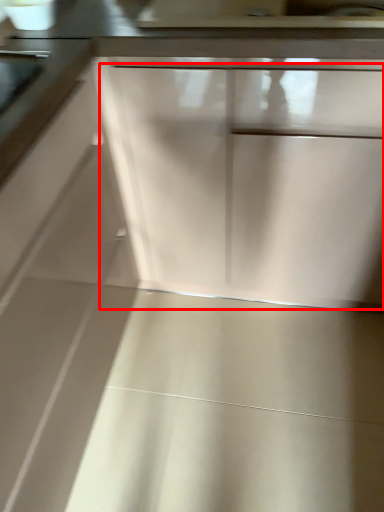
Question: Considering the relative positions of drawer (annotated by the red box) and door handle in the image provided, where is drawer (annotated by the red box) located with respect to the staircase?

Choices:
 (A) left
 (B) right

Answer: (B)